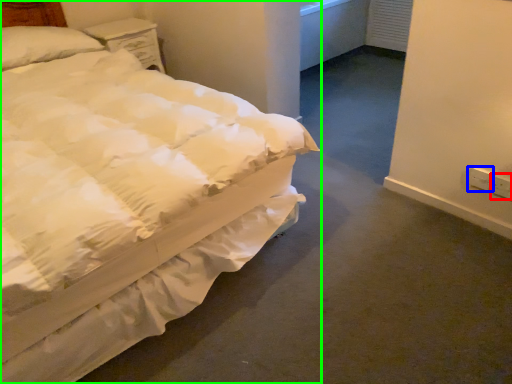
Question: Which object is the farthest from electric outlet (highlighted by a red box)? Choose among these: electric outlet (highlighted by a blue box) or bed (highlighted by a green box).

Choices:
 (A) electric outlet
 (B) bed

Answer: (B)